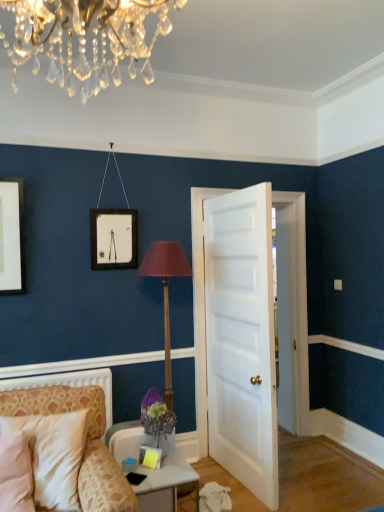
Question: Does point (152, 244) appear closer or farther from the camera than point (195, 479)?

Choices:
 (A) closer
 (B) farther

Answer: (B)

Question: In the image, is wooden table lamp at center on the left side or the right side of white glossy table at lower center?

Choices:
 (A) left
 (B) right

Answer: (B)

Question: Considering the real-world distances, which object is closest to the patterned fabric chair at lower left?

Choices:
 (A) wooden table lamp at center
 (B) white painted wood door at center
 (C) white glossy table at lower center

Answer: (C)

Question: Which object is the closest to the patterned fabric chair at lower left?

Choices:
 (A) wooden table lamp at center
 (B) white painted wood door at center
 (C) white glossy table at lower center

Answer: (C)